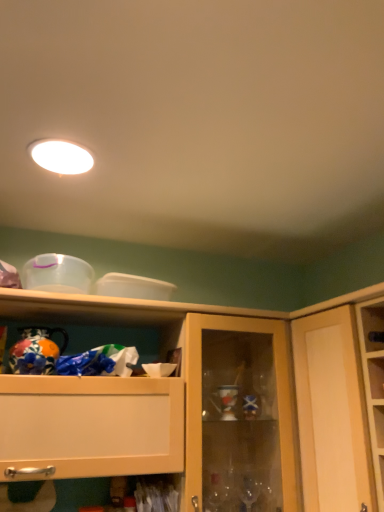
This screenshot has width=384, height=512. I want to click on free space above white glossy light fixture at upper center (from a real-world perspective), so click(x=63, y=155).